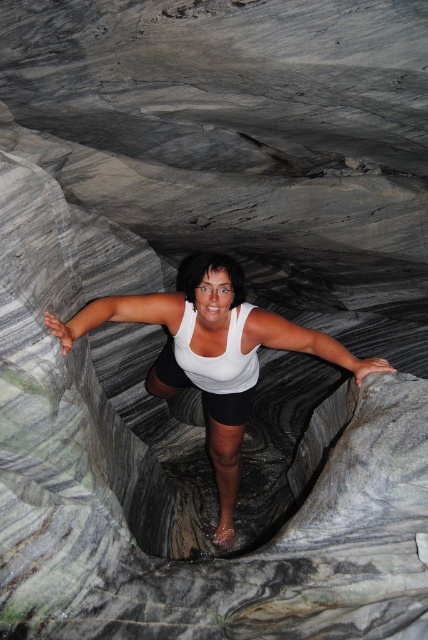
You are a photographer trying to capture the person in the rock formation. You notice the white matte tank top at center and the white matte arm at center. Which object is positioned lower in the image?

The white matte tank top at center is below the white matte arm at center, so the white matte tank top at center is positioned lower in the image.

You are a photographer trying to capture the rock formation from the best angle. You notice two points marked on the rock formation at coordinates point (341, 360) and point (95, 300). Which point is positioned closer to your camera lens if you are standing where the person is?

Point (341, 360) is closer to the viewer than point (95, 300), so it would be positioned closer to your camera lens.